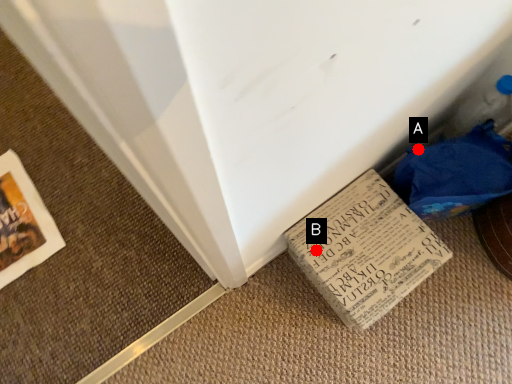
Question: Two points are circled on the image, labeled by A and B beside each circle. Which point appears closest to the camera in this image?

Choices:
 (A) A is closer
 (B) B is closer

Answer: (B)